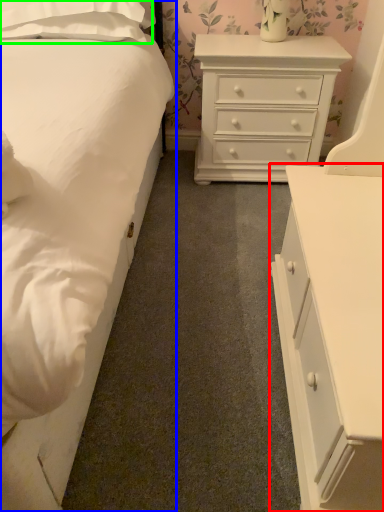
Question: Which object is positioned farthest from chest of drawers (highlighted by a red box)? Select from bed (highlighted by a blue box) and pillow (highlighted by a green box).

Choices:
 (A) bed
 (B) pillow

Answer: (B)